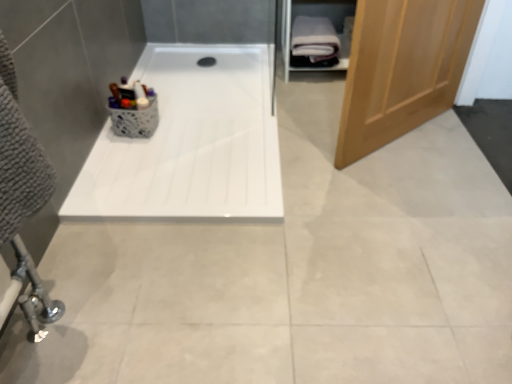
Question: From a real-world perspective, is white soft towel at upper right positioned under white glossy bathtub at center based on gravity?

Choices:
 (A) yes
 (B) no

Answer: (B)

Question: Does white soft towel at upper right turn towards white glossy bathtub at center?

Choices:
 (A) no
 (B) yes

Answer: (A)

Question: From the image's perspective, would you say white soft towel at upper right is shown under white glossy bathtub at center?

Choices:
 (A) yes
 (B) no

Answer: (B)

Question: Can you confirm if white soft towel at upper right is wider than white glossy bathtub at center?

Choices:
 (A) yes
 (B) no

Answer: (B)

Question: Does white soft towel at upper right come in front of white glossy bathtub at center?

Choices:
 (A) yes
 (B) no

Answer: (B)

Question: Which is correct: white soft towel at upper right is inside light brown wooden door at right, or outside of it?

Choices:
 (A) outside
 (B) inside

Answer: (A)

Question: In the image, is white soft towel at upper right positioned in front of or behind light brown wooden door at right?

Choices:
 (A) front
 (B) behind

Answer: (B)

Question: Does point (310, 56) appear closer or farther from the camera than point (441, 39)?

Choices:
 (A) closer
 (B) farther

Answer: (B)

Question: Visually, is white soft towel at upper right positioned to the left or to the right of light brown wooden door at right?

Choices:
 (A) right
 (B) left

Answer: (B)

Question: From the image's perspective, is white soft towel at upper right located above or below white glossy bathtub at center?

Choices:
 (A) above
 (B) below

Answer: (A)

Question: In terms of size, does white soft towel at upper right appear bigger or smaller than white glossy bathtub at center?

Choices:
 (A) big
 (B) small

Answer: (B)

Question: In terms of height, does white soft towel at upper right look taller or shorter compared to white glossy bathtub at center?

Choices:
 (A) tall
 (B) short

Answer: (A)

Question: Considering the positions of white soft towel at upper right and white glossy bathtub at center in the image, is white soft towel at upper right wider or thinner than white glossy bathtub at center?

Choices:
 (A) thin
 (B) wide

Answer: (A)

Question: Is point (105, 130) positioned closer to the camera than point (458, 21)?

Choices:
 (A) farther
 (B) closer

Answer: (A)

Question: In the image, is white glossy bathtub at center on the left side or the right side of light brown wooden door at right?

Choices:
 (A) right
 (B) left

Answer: (B)